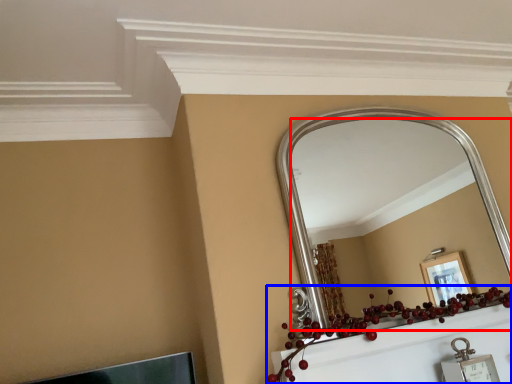
Question: Which of the following is the closest to the observer, mirror (highlighted by a red box) or christmas decoration (highlighted by a blue box)?

Choices:
 (A) mirror
 (B) christmas decoration

Answer: (B)